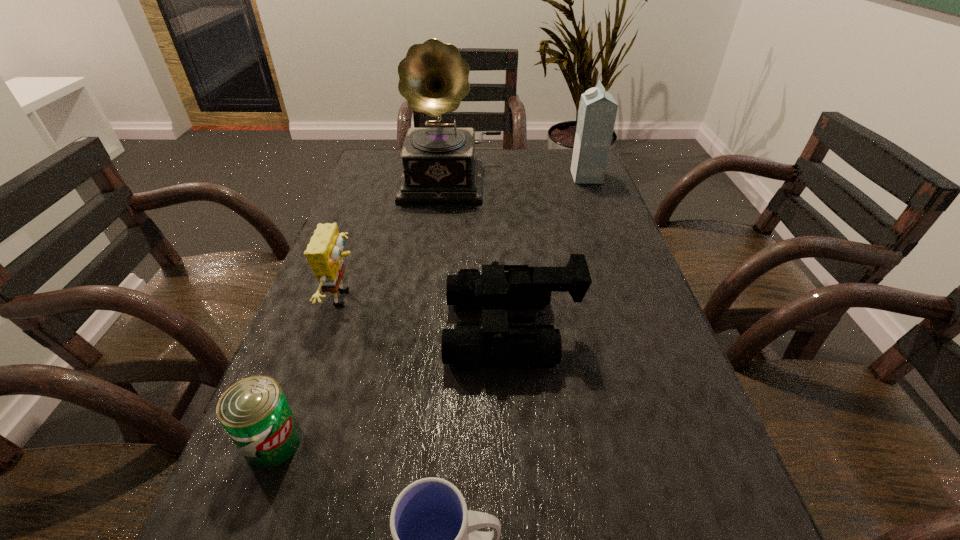
Where is `object located at the right edge`? The width and height of the screenshot is (960, 540). object located at the right edge is located at coordinates (597, 112).

The width and height of the screenshot is (960, 540). In order to click on object at the far left corner in this screenshot , I will do `click(439, 165)`.

You are a GUI agent. You are given a task and a screenshot of the screen. Output one action in this format:
    pyautogui.click(x=<x>, y=<y>)
    Task: Click on the object that is at the far right corner
    This screenshot has height=540, width=960.
    Given the screenshot: What is the action you would take?
    pyautogui.click(x=597, y=112)

Locate an element on the screen. free space at the far edge of the desktop is located at coordinates (539, 170).

Image resolution: width=960 pixels, height=540 pixels. In the image, there is a desktop. Identify the location of vacant area at the left edge. (394, 234).

The width and height of the screenshot is (960, 540). Find the location of `vacant space at the right edge`. vacant space at the right edge is located at coordinates (717, 529).

Image resolution: width=960 pixels, height=540 pixels. Find the location of `empty space that is in between the sponge and the fifth shortest object`. empty space that is in between the sponge and the fifth shortest object is located at coordinates (466, 237).

In order to click on vacant region between the rightmost object and the binoculars in this screenshot , I will do `click(548, 253)`.

Where is `vacant point located between the second nearest object and the record player`? vacant point located between the second nearest object and the record player is located at coordinates (362, 312).

Where is `free spot between the fifth shortest object and the binoculars`? The height and width of the screenshot is (540, 960). free spot between the fifth shortest object and the binoculars is located at coordinates (548, 253).